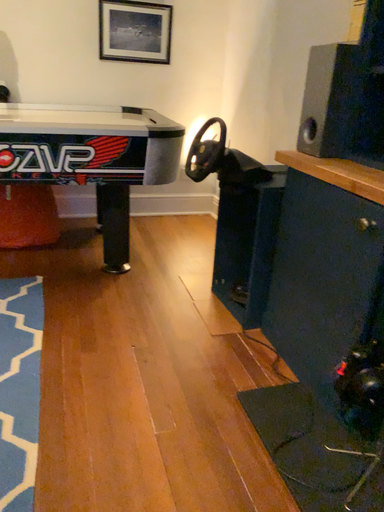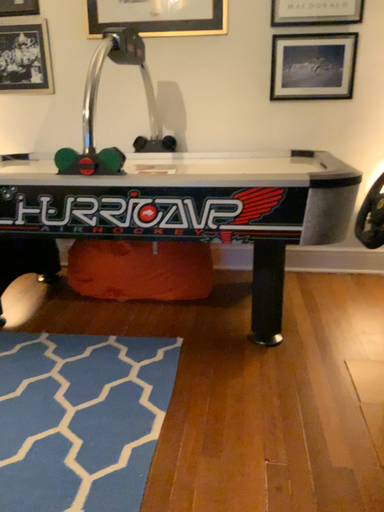
Question: Which way did the camera rotate in the video?

Choices:
 (A) rotated downward
 (B) rotated upward

Answer: (B)